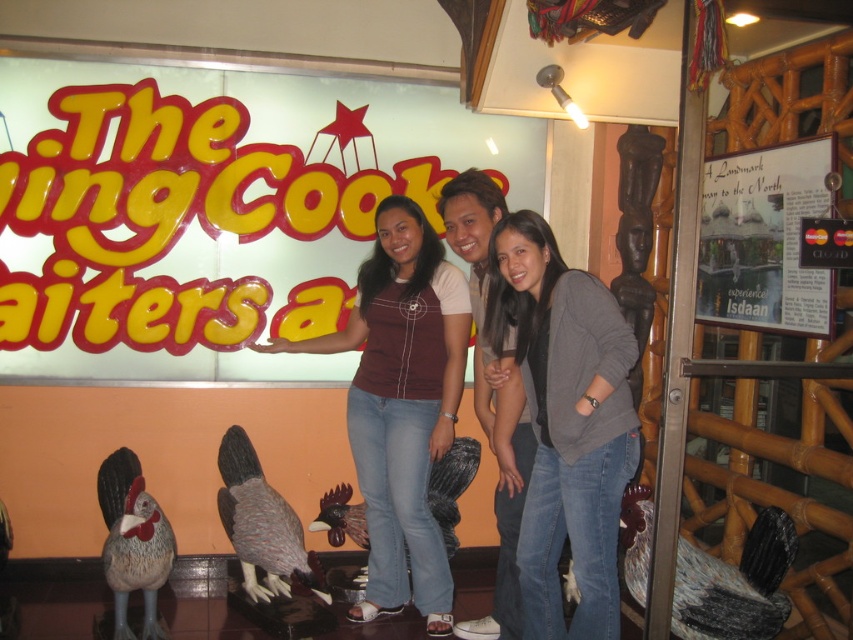
You are a photographer trying to capture a clear shot of both the maroon fabric shirt at center and the matte gray rooster at center. Since the camera can only focus on one subject at a time, which subject should you focus on first to ensure the other is still somewhat in focus?

The maroon fabric shirt at center is positioned under matte gray rooster at center, so focusing on the matte gray rooster at center first would keep the maroon fabric shirt at center in the foreground within the depth of field.

You are a photographer trying to capture a detailed shot of both the gray matte sweater at center and the white paper sign at upper right. Which object should you focus on first to ensure both are in focus without adjusting the camera settings?

The gray matte sweater at center is closer to the viewer than the white paper sign at upper right. To ensure both are in focus, you should focus on the gray matte sweater at center first, as it is the closer object, and the depth of field will extend to the white paper sign at upper right.

You are a photographer trying to capture a clear shot of the gray matte sweater at center and the white paper sign at upper right. Which object should you focus on first if you want to ensure both are in focus without adjusting your camera settings?

You should focus on the gray matte sweater at center first because it is larger in size than the white paper sign at upper right, so focusing on the larger object will help ensure both are in focus.